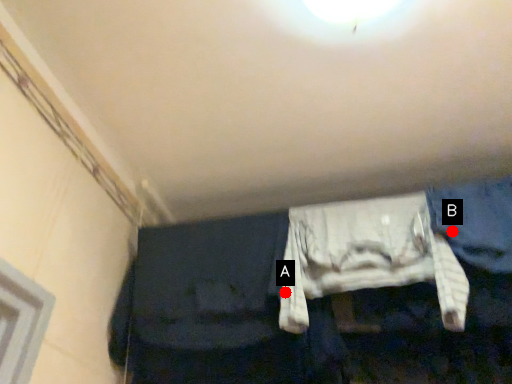
Question: Two points are circled on the image, labeled by A and B beside each circle. Which point appears closest to the camera in this image?

Choices:
 (A) A is closer
 (B) B is closer

Answer: (A)